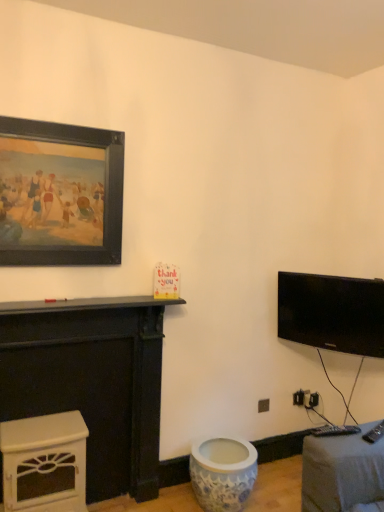
Question: Is white glossy fireplace at lower left, which is counted as the 1th furniture, starting from the bottom, at the back of blue porcelain vase at lower center?

Choices:
 (A) yes
 (B) no

Answer: (B)

Question: Does blue porcelain vase at lower center have a lesser height compared to white glossy fireplace at lower left, which is counted as the 2th furniture, starting from the top?

Choices:
 (A) yes
 (B) no

Answer: (A)

Question: From the image's perspective, is blue porcelain vase at lower center under white glossy fireplace at lower left, which is counted as the 1th furniture, starting from the bottom?

Choices:
 (A) yes
 (B) no

Answer: (A)

Question: Does blue porcelain vase at lower center have a greater height compared to white glossy fireplace at lower left, which is counted as the 2th furniture, starting from the top?

Choices:
 (A) no
 (B) yes

Answer: (A)

Question: Is blue porcelain vase at lower center wider than white glossy fireplace at lower left, which is counted as the 2th furniture, starting from the top?

Choices:
 (A) yes
 (B) no

Answer: (A)

Question: From a real-world perspective, relative to white glossy fireplace at lower left, which is counted as the 1th furniture, starting from the bottom, is black glossy tv at upper right vertically above or below?

Choices:
 (A) above
 (B) below

Answer: (A)

Question: Does point (329, 278) appear closer or farther from the camera than point (26, 489)?

Choices:
 (A) closer
 (B) farther

Answer: (B)

Question: Is black glossy tv at upper right spatially inside white glossy fireplace at lower left, which is counted as the 1th furniture, starting from the bottom, or outside of it?

Choices:
 (A) outside
 (B) inside

Answer: (A)

Question: In the image, is black glossy tv at upper right on the left side or the right side of white glossy fireplace at lower left, which is counted as the 2th furniture, starting from the top?

Choices:
 (A) left
 (B) right

Answer: (B)

Question: From the image's perspective, is white painted wood fireplace at left, the first furniture from the top, above or below blue porcelain vase at lower center?

Choices:
 (A) above
 (B) below

Answer: (A)

Question: In terms of width, does white painted wood fireplace at left, the first furniture from the top, look wider or thinner when compared to blue porcelain vase at lower center?

Choices:
 (A) thin
 (B) wide

Answer: (A)

Question: In terms of size, does white painted wood fireplace at left, the 2th furniture ordered from the bottom, appear bigger or smaller than blue porcelain vase at lower center?

Choices:
 (A) big
 (B) small

Answer: (A)

Question: Is point (155, 426) closer or farther from the camera than point (205, 450)?

Choices:
 (A) farther
 (B) closer

Answer: (A)

Question: In terms of height, does blue porcelain vase at lower center look taller or shorter compared to black matte picture frame at upper left?

Choices:
 (A) short
 (B) tall

Answer: (A)

Question: Considering the positions of blue porcelain vase at lower center and black matte picture frame at upper left in the image, is blue porcelain vase at lower center bigger or smaller than black matte picture frame at upper left?

Choices:
 (A) big
 (B) small

Answer: (A)